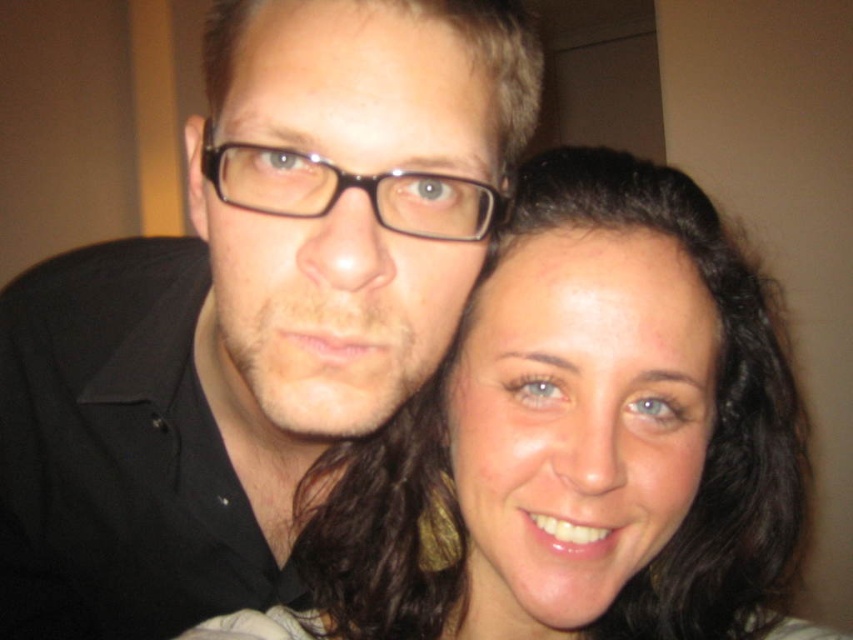
Question: Estimate the real-world distances between objects in this image. Which object is farther from the black plastic glasses at center?

Choices:
 (A) matte black shirt at left
 (B) matte black hair at center

Answer: (A)

Question: Which point is farther to the camera?

Choices:
 (A) (585, 570)
 (B) (225, 186)
 (C) (268, 198)

Answer: (A)

Question: Which object is farther from the camera taking this photo?

Choices:
 (A) matte black hair at center
 (B) matte black shirt at left

Answer: (A)

Question: Does matte black hair at center appear under black plastic glasses at center?

Choices:
 (A) no
 (B) yes

Answer: (B)

Question: Is matte black shirt at left wider than matte black hair at center?

Choices:
 (A) yes
 (B) no

Answer: (A)

Question: Is matte black shirt at left wider than black plastic glasses at center?

Choices:
 (A) no
 (B) yes

Answer: (B)